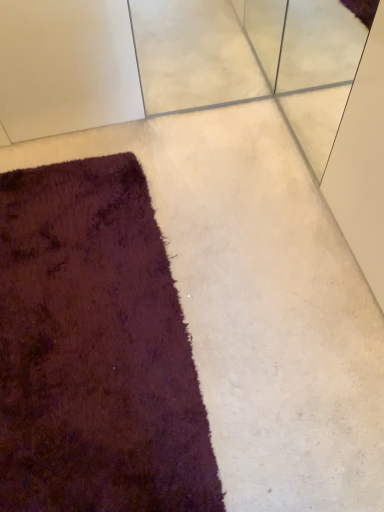
Question: In the image, is white textured concrete at upper center positioned in front of or behind shaggy dark purple rug at lower left?

Choices:
 (A) behind
 (B) front

Answer: (A)

Question: Considering the positions of white textured concrete at upper center and shaggy dark purple rug at lower left in the image, is white textured concrete at upper center bigger or smaller than shaggy dark purple rug at lower left?

Choices:
 (A) small
 (B) big

Answer: (A)

Question: Considering the positions of white textured concrete at upper center and shaggy dark purple rug at lower left in the image, is white textured concrete at upper center wider or thinner than shaggy dark purple rug at lower left?

Choices:
 (A) thin
 (B) wide

Answer: (A)

Question: Is shaggy dark purple rug at lower left taller or shorter than white textured concrete at upper center?

Choices:
 (A) tall
 (B) short

Answer: (B)

Question: Is shaggy dark purple rug at lower left spatially inside white textured concrete at upper center, or outside of it?

Choices:
 (A) outside
 (B) inside

Answer: (A)

Question: Looking at their shapes, would you say shaggy dark purple rug at lower left is wider or thinner than white textured concrete at upper center?

Choices:
 (A) wide
 (B) thin

Answer: (A)

Question: Is shaggy dark purple rug at lower left bigger or smaller than white textured concrete at upper center?

Choices:
 (A) small
 (B) big

Answer: (B)